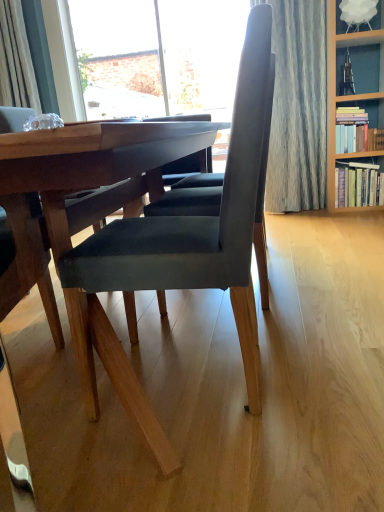
Question: From the image's perspective, is hardcover book at right, the 1th book from the bottom, located beneath velvet dark gray chair at center?

Choices:
 (A) yes
 (B) no

Answer: (B)

Question: Considering the relative sizes of hardcover book at right, the second book in the top-to-bottom sequence, and velvet dark gray chair at center in the image provided, is hardcover book at right, the second book in the top-to-bottom sequence, shorter than velvet dark gray chair at center?

Choices:
 (A) yes
 (B) no

Answer: (A)

Question: Would you say hardcover book at right, the 1th book from the bottom, is outside velvet dark gray chair at center?

Choices:
 (A) no
 (B) yes

Answer: (B)

Question: Considering the relative sizes of hardcover book at right, the 1th book from the bottom, and velvet dark gray chair at center in the image provided, is hardcover book at right, the 1th book from the bottom, wider than velvet dark gray chair at center?

Choices:
 (A) yes
 (B) no

Answer: (B)

Question: From a real-world perspective, is hardcover book at right, the second book in the top-to-bottom sequence, below velvet dark gray chair at center?

Choices:
 (A) yes
 (B) no

Answer: (A)

Question: From a real-world perspective, relative to hardcover books at upper right, the 1th book from the top, is hardcover book at right, the second book in the top-to-bottom sequence, vertically above or below?

Choices:
 (A) above
 (B) below

Answer: (B)

Question: Looking at the image, does hardcover book at right, the 1th book from the bottom, seem bigger or smaller compared to hardcover books at upper right, arranged as the 2th book when ordered from the bottom?

Choices:
 (A) big
 (B) small

Answer: (A)

Question: From the image's perspective, is hardcover book at right, the 1th book from the bottom, positioned above or below hardcover books at upper right, the 1th book from the top?

Choices:
 (A) above
 (B) below

Answer: (B)

Question: Is hardcover book at right, the second book in the top-to-bottom sequence, to the left or to the right of hardcover books at upper right, the 1th book from the top, in the image?

Choices:
 (A) right
 (B) left

Answer: (A)

Question: Is hardcover books at upper right, the 1th book from the top, wider or thinner than hardcover book at right, the 1th book from the bottom?

Choices:
 (A) thin
 (B) wide

Answer: (A)

Question: Relative to hardcover book at right, the second book in the top-to-bottom sequence, is hardcover books at upper right, the 1th book from the top, in front or behind?

Choices:
 (A) behind
 (B) front

Answer: (B)

Question: From a real-world perspective, is hardcover books at upper right, arranged as the 2th book when ordered from the bottom, positioned above or below hardcover book at right, the 1th book from the bottom?

Choices:
 (A) above
 (B) below

Answer: (A)

Question: Does point (336, 117) appear closer or farther from the camera than point (367, 172)?

Choices:
 (A) farther
 (B) closer

Answer: (B)

Question: Visually, is velvet dark gray chair at center positioned to the left or to the right of hardcover books at upper right, arranged as the 2th book when ordered from the bottom?

Choices:
 (A) left
 (B) right

Answer: (A)

Question: Looking at the image, does velvet dark gray chair at center seem bigger or smaller compared to hardcover books at upper right, the 1th book from the top?

Choices:
 (A) big
 (B) small

Answer: (A)